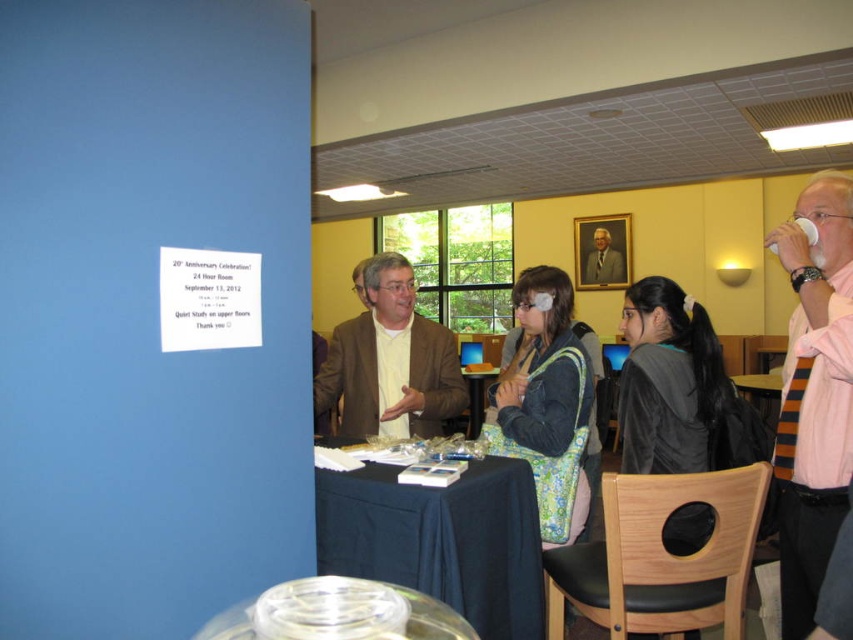
You are a photographer preparing to take a group photo of the attendees. You notice the pink striped tie at right and the formal suit at center. Which object is closer to the camera?

The pink striped tie at right is closer to the camera because it is in front of the formal suit at center.

What is located at the coordinates point (440, 540) in the image?

The black clothed table at center is located at point (440, 540).

You are a guest at the 20th Anniversary Celebration. You see a black clothed table at center and a formal suit at center. Which object is closer to the floor?

The black clothed table at center is closer to the floor since it is located below the formal suit at center.